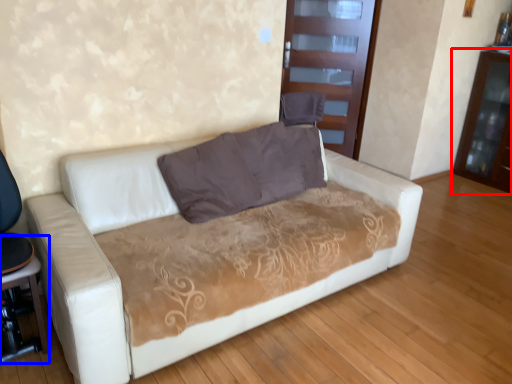
Question: Which point is closer to the camera, dresser (highlighted by a red box) or table (highlighted by a blue box)?

Choices:
 (A) dresser
 (B) table

Answer: (B)